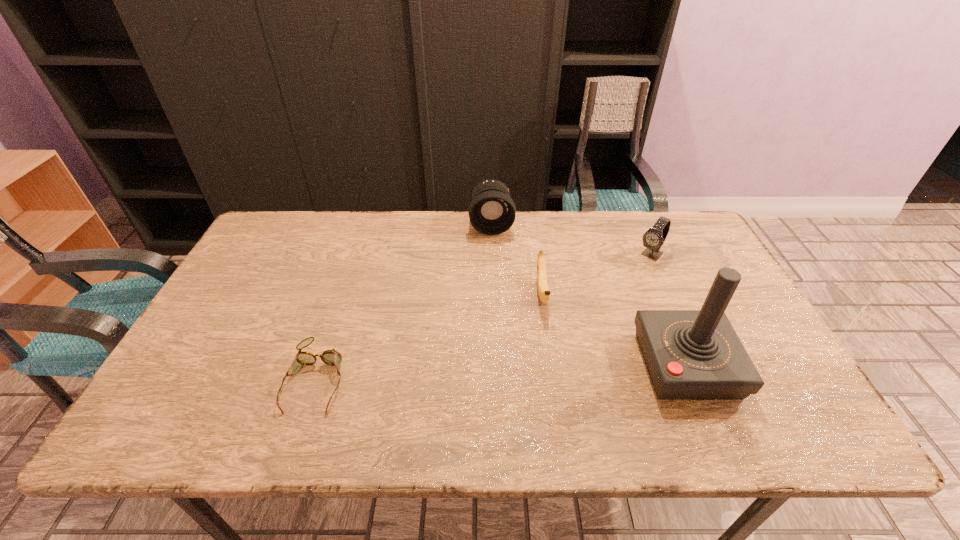
The height and width of the screenshot is (540, 960). In order to click on free space on the desktop that is between the leftmost object and the joystick and is positioned on the face of the second farthest object in this screenshot , I will do `click(544, 370)`.

I want to click on vacant space on the desktop that is between the shortest object and the tallest object and is positioned at the front element of the telephoto lens, so click(x=502, y=372).

Identify the location of free space on the desktop that is between the spectacles and the joystick and is positioned at the stem of the third farthest object. Image resolution: width=960 pixels, height=540 pixels. (551, 370).